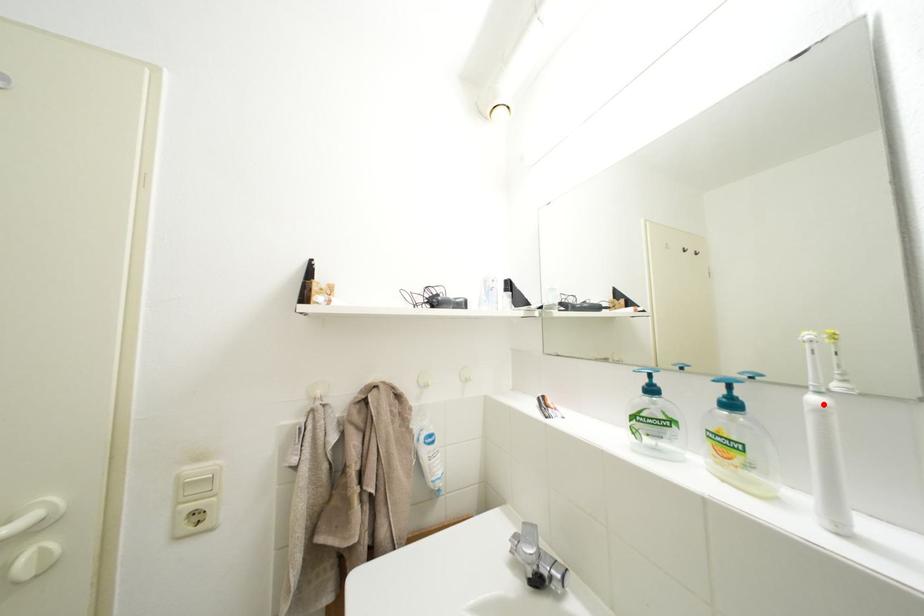
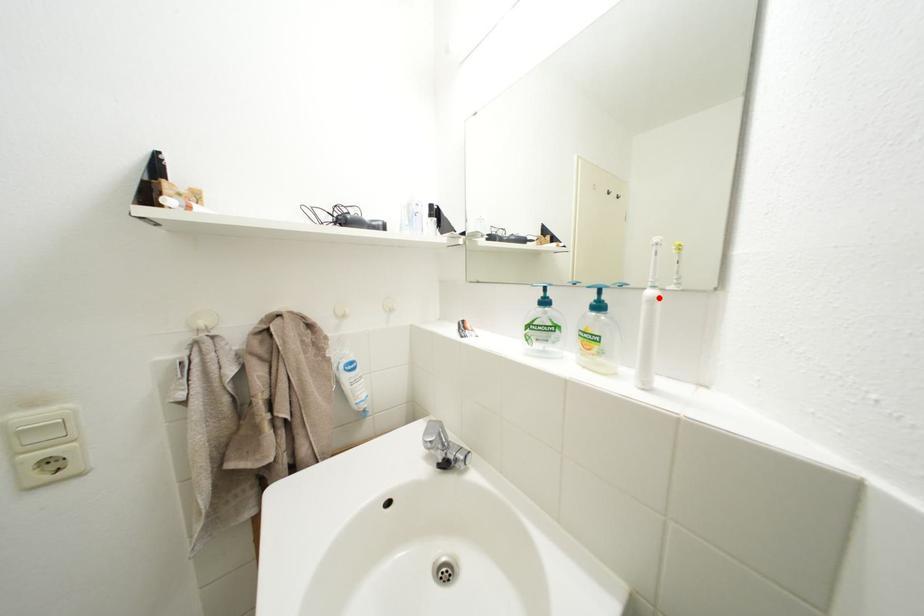
I am providing you with two images of the same scene from different viewpoints. A red point is marked on the first image and another point is marked on the second image. Does the point marked in image1 correspond to the same location as the one in image2?

Yes